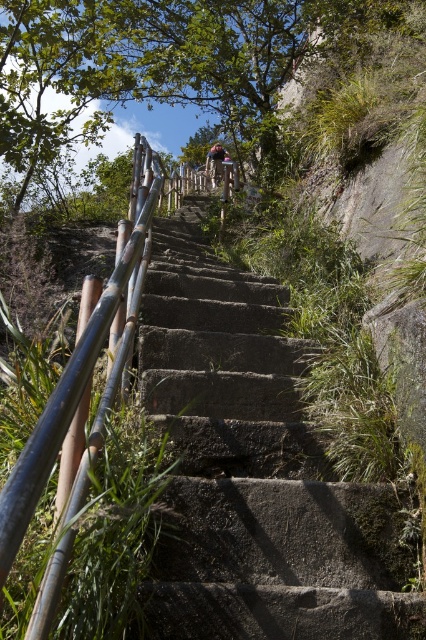
You are a hiker standing at the base of the stone stairs leading up into the forest. You notice the brown bamboo rail at left. Based on its position, can you estimate where it is located relative to the center of the stairs?

The brown bamboo rail at left is located at point (80, 403), which is to the left side of the stairs and closer to the lower part compared to the center.

You are a hiker wearing the blue denim jeans at center and want to grab the brown bamboo rail at left for support. Can you reach it without moving your feet?

The brown bamboo rail at left is below the blue denim jeans at center, so you can easily reach it without moving your feet.